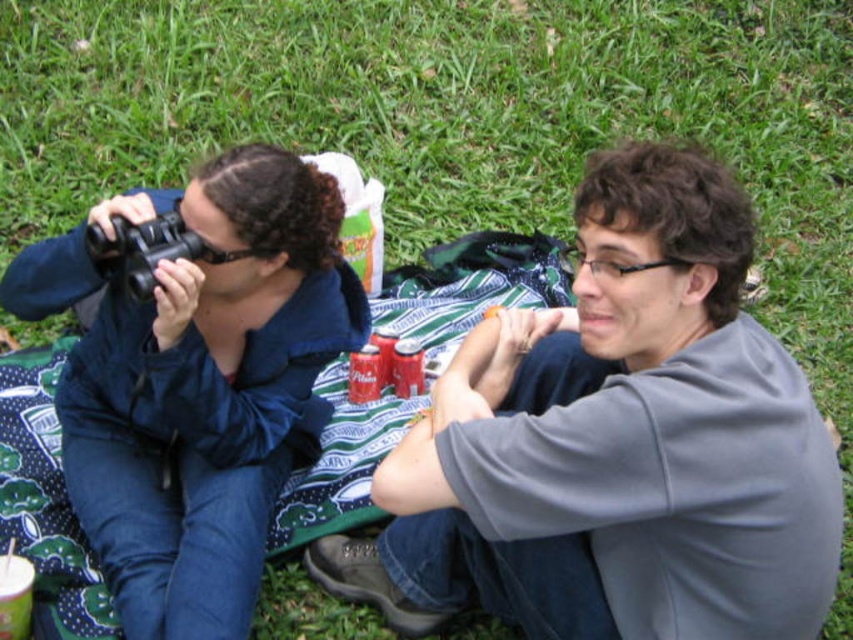
Is matte black binoculars at left closer to the viewer compared to black plastic binoculars at upper left?

No, matte black binoculars at left is behind black plastic binoculars at upper left.

Is point (202, 385) farther from camera compared to point (163, 244)?

Yes, it is behind point (163, 244).

Locate an element on the screen. The image size is (853, 640). matte black binoculars at left is located at coordinates (196, 381).